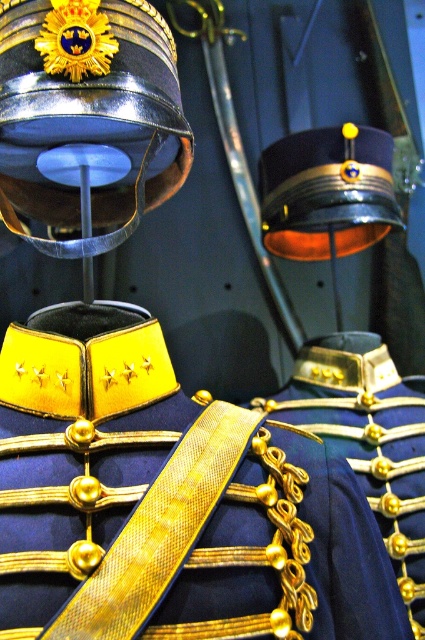
Between navy blue fabric with gold trim at center and shiny black helmet at upper center, which one appears on the right side from the viewer's perspective?

shiny black helmet at upper center

Which of these two, navy blue fabric with gold trim at center or shiny black helmet at upper center, stands taller?

With more height is navy blue fabric with gold trim at center.

Identify the location of navy blue fabric with gold trim at center. (169, 500).

Looking at this image, does navy blue fabric with gold trim at center appear under gold metallic chain at center?

Actually, navy blue fabric with gold trim at center is above gold metallic chain at center.

Between point (351, 504) and point (405, 566), which one is positioned in front?

Point (351, 504) is more forward.

Locate an element on the screen. navy blue fabric with gold trim at center is located at coordinates (169, 500).

Is gold metallic chain at center below shiny black helmet at upper center?

Yes.

The width and height of the screenshot is (425, 640). What are the coordinates of `gold metallic chain at center` in the screenshot? It's located at (368, 440).